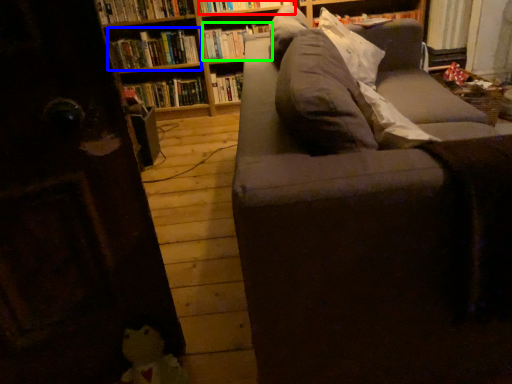
Question: Which is farther away from book (highlighted by a red box)? book (highlighted by a blue box) or book (highlighted by a green box)?

Choices:
 (A) book
 (B) book

Answer: (A)